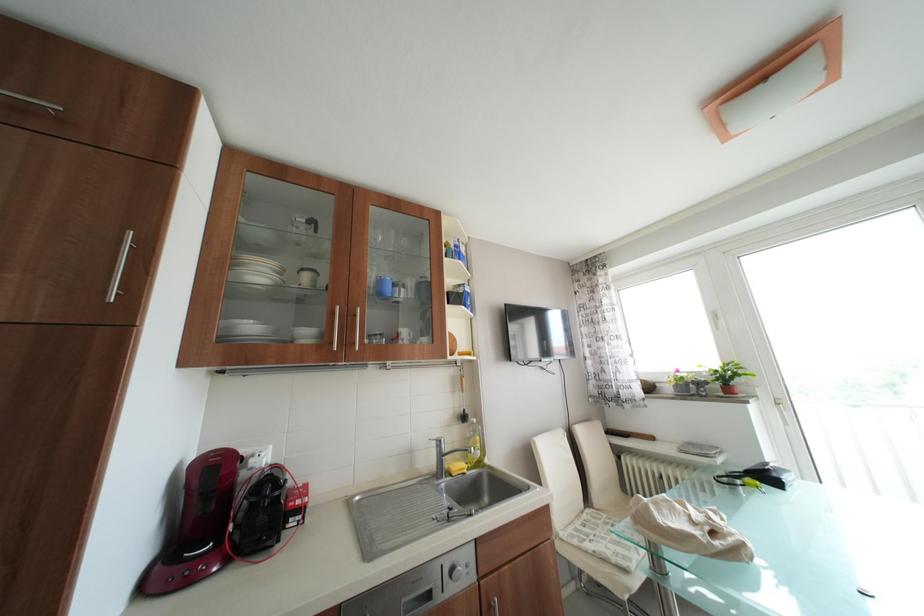
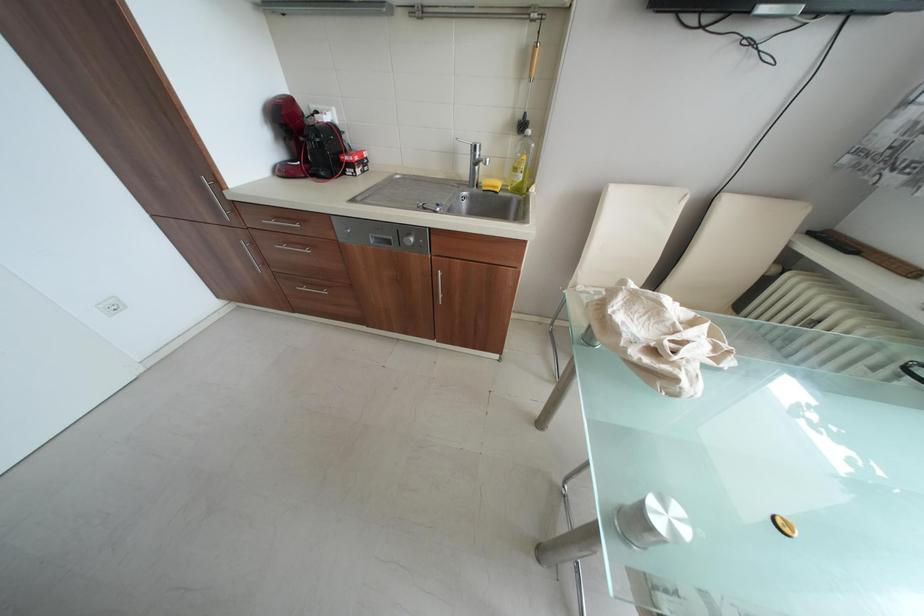
How did the camera likely rotate?

The camera rotated toward left-down.